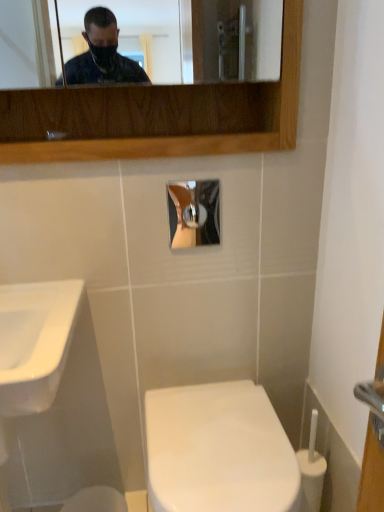
The height and width of the screenshot is (512, 384). What do you see at coordinates (96, 500) in the screenshot?
I see `white glossy toilet bowl at lower center` at bounding box center [96, 500].

The image size is (384, 512). What do you see at coordinates (218, 450) in the screenshot? I see `white glossy toilet at center` at bounding box center [218, 450].

What is the approximate width of white glossy sink at left?

18.82 inches.

In order to click on white glossy toilet bowl at lower center in this screenshot , I will do `click(96, 500)`.

Considering the positions of objects white glossy sink at left and white glossy toilet bowl at lower center in the image provided, who is behind, white glossy sink at left or white glossy toilet bowl at lower center?

Positioned behind is white glossy toilet bowl at lower center.

From the image's perspective, would you say white glossy sink at left is positioned over white glossy toilet bowl at lower center?

Yes, from the image's perspective, white glossy sink at left is above white glossy toilet bowl at lower center.

Is white glossy sink at left positioned beyond the bounds of white glossy toilet bowl at lower center?

That's correct, white glossy sink at left is outside of white glossy toilet bowl at lower center.

Who is smaller, white glossy sink at left or white glossy toilet bowl at lower center?

With smaller size is white glossy toilet bowl at lower center.

Is white glossy toilet at center further to the viewer compared to white glossy sink at left?

Yes, white glossy toilet at center is further from the viewer.

Considering the sizes of objects white glossy toilet at center and white glossy sink at left in the image provided, who is shorter, white glossy toilet at center or white glossy sink at left?

Standing shorter between the two is white glossy sink at left.

How much distance is there between matte silver faucet at upper center and white glossy toilet at center?

matte silver faucet at upper center is 37.04 inches away from white glossy toilet at center.

Does matte silver faucet at upper center have a lesser width compared to white glossy toilet at center?

Yes.

Considering the relative positions of matte silver faucet at upper center and white glossy toilet at center in the image provided, is matte silver faucet at upper center to the left or to the right of white glossy toilet at center?

matte silver faucet at upper center is positioned on white glossy toilet at center's left side.

Does matte silver faucet at upper center lie behind white glossy toilet at center?

Yes, matte silver faucet at upper center is behind white glossy toilet at center.

Looking at this image, is white glossy sink at left positioned far away from matte silver faucet at upper center?

No, white glossy sink at left is in close proximity to matte silver faucet at upper center.

In the scene shown: From a real-world perspective, between white glossy sink at left and matte silver faucet at upper center, who is vertically higher?

From a 3D spatial view, matte silver faucet at upper center is above.

How far apart are white glossy sink at left and matte silver faucet at upper center?

The distance of white glossy sink at left from matte silver faucet at upper center is 21.83 inches.

Is white glossy sink at left inside the boundaries of matte silver faucet at upper center, or outside?

white glossy sink at left is spatially situated outside matte silver faucet at upper center.

Is white glossy toilet bowl at lower center facing towards white glossy sink at left?

No, white glossy toilet bowl at lower center is not aimed at white glossy sink at left.

From the picture: Is the surface of white glossy toilet bowl at lower center in direct contact with white glossy sink at left?

No, white glossy toilet bowl at lower center is not in contact with white glossy sink at left.

In terms of height, does white glossy toilet bowl at lower center look taller or shorter compared to white glossy sink at left?

Clearly, white glossy toilet bowl at lower center is shorter compared to white glossy sink at left.

From a real-world perspective, is matte silver faucet at upper center on white glossy toilet bowl at lower center?

Yes, from a real-world perspective, matte silver faucet at upper center is above white glossy toilet bowl at lower center.

Is matte silver faucet at upper center wider than white glossy toilet bowl at lower center?

No.

Would you consider matte silver faucet at upper center to be distant from white glossy toilet bowl at lower center?

matte silver faucet at upper center is positioned a significant distance from white glossy toilet bowl at lower center.

From the image's perspective, would you say matte silver faucet at upper center is positioned over white glossy toilet bowl at lower center?

Yes, from the image's perspective, matte silver faucet at upper center is over white glossy toilet bowl at lower center.

From the picture: From the image's perspective, which one is positioned higher, matte silver faucet at upper center or white glossy sink at left?

From the image's view, matte silver faucet at upper center is above.

Which object is further away from the camera taking this photo, matte silver faucet at upper center or white glossy sink at left?

matte silver faucet at upper center is further from the camera.

Considering the relative sizes of matte silver faucet at upper center and white glossy sink at left in the image provided, is matte silver faucet at upper center taller than white glossy sink at left?

In fact, matte silver faucet at upper center may be shorter than white glossy sink at left.

From a real-world perspective, between matte silver faucet at upper center and white glossy sink at left, who is vertically lower?

white glossy sink at left, from a real-world perspective.

You are a GUI agent. You are given a task and a screenshot of the screen. Output one action in this format:
    pyautogui.click(x=<x>, y=<y>)
    Task: Click on the toilet bowl lying below the white glossy sink at left (from the image's perspective)
    Image resolution: width=384 pixels, height=512 pixels.
    Given the screenshot: What is the action you would take?
    pyautogui.click(x=96, y=500)

Locate an element on the screen. The width and height of the screenshot is (384, 512). toilet on the right of white glossy sink at left is located at coordinates (218, 450).

Which object lies nearer to the anchor point white glossy toilet bowl at lower center, matte silver faucet at upper center or white glossy sink at left?

white glossy sink at left is positioned closer to the anchor white glossy toilet bowl at lower center.

Which object lies further to the anchor point white glossy sink at left, matte silver faucet at upper center or white glossy toilet bowl at lower center?

white glossy toilet bowl at lower center lies further to white glossy sink at left than the other object.

From the picture: Based on their spatial positions, is white glossy toilet at center or white glossy sink at left further from matte silver faucet at upper center?

Among the two, white glossy toilet at center is located further to matte silver faucet at upper center.

Considering their positions, is white glossy toilet bowl at lower center positioned further to matte silver faucet at upper center than white glossy sink at left?

Among the two, white glossy toilet bowl at lower center is located further to matte silver faucet at upper center.

Looking at the image, which one is located closer to white glossy toilet at center, white glossy sink at left or matte silver faucet at upper center?

white glossy sink at left lies closer to white glossy toilet at center than the other object.

Based on the photo, considering their positions, is white glossy toilet bowl at lower center positioned closer to white glossy sink at left than matte silver faucet at upper center?

matte silver faucet at upper center is closer to white glossy sink at left.

Considering their positions, is white glossy toilet bowl at lower center positioned further to white glossy toilet at center than matte silver faucet at upper center?

matte silver faucet at upper center lies further to white glossy toilet at center than the other object.

From the image, which object appears to be farther from matte silver faucet at upper center, white glossy toilet at center or white glossy toilet bowl at lower center?

white glossy toilet bowl at lower center is positioned further to the anchor matte silver faucet at upper center.

Identify the location of toilet between matte silver faucet at upper center and white glossy toilet bowl at lower center in the vertical direction. This screenshot has height=512, width=384. (218, 450).

Where is `sink between matte silver faucet at upper center and white glossy toilet at center in the up-down direction`? The image size is (384, 512). sink between matte silver faucet at upper center and white glossy toilet at center in the up-down direction is located at coordinates (35, 342).

Image resolution: width=384 pixels, height=512 pixels. I want to click on toilet between white glossy sink at left and white glossy toilet bowl at lower center from top to bottom, so click(218, 450).

Where is `sink between matte silver faucet at upper center and white glossy toilet bowl at lower center vertically`? Image resolution: width=384 pixels, height=512 pixels. sink between matte silver faucet at upper center and white glossy toilet bowl at lower center vertically is located at coordinates (35, 342).